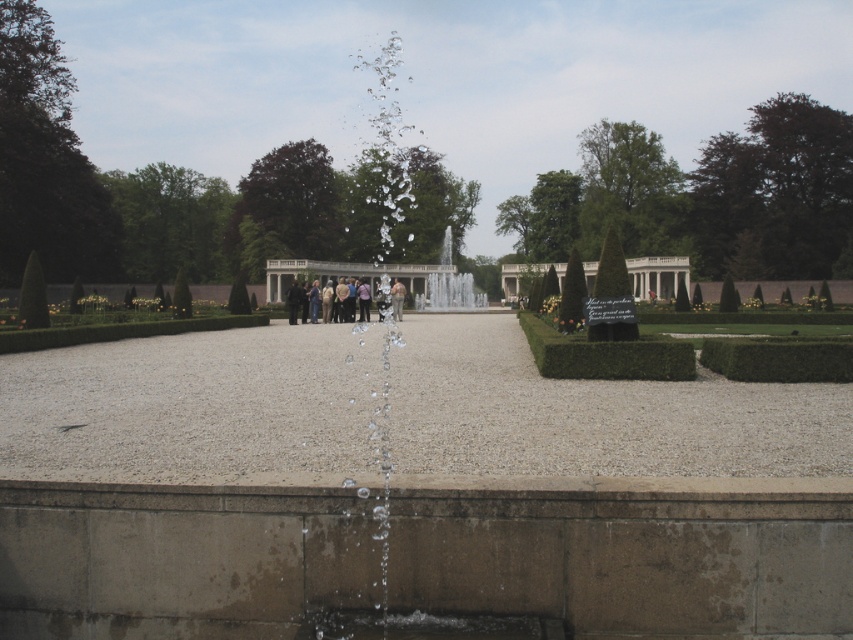
Describe the element at coordinates (450, 285) in the screenshot. I see `clear glass water at center` at that location.

Does point (450, 228) come farther from viewer compared to point (311, 285)?

Yes, point (450, 228) is farther from viewer.

You are a GUI agent. You are given a task and a screenshot of the screen. Output one action in this format:
    pyautogui.click(x=<x>, y=<y>)
    Task: Click on the clear glass water at center
    Image resolution: width=853 pixels, height=640 pixels.
    Given the screenshot: What is the action you would take?
    pyautogui.click(x=450, y=285)

How much distance is there between white stone palace at center and matte black people at center?

They are 23.28 meters apart.

Between point (585, 285) and point (332, 292), which one is positioned behind?

Positioned behind is point (332, 292).

Does point (645, 257) come behind point (312, 298)?

That is True.

This screenshot has height=640, width=853. I want to click on white stone palace at center, so click(x=657, y=275).

Does gray gravel path at center appear under green hedge at lower right?

Indeed, gray gravel path at center is positioned under green hedge at lower right.

Which is more to the left, gray gravel path at center or green hedge at lower right?

gray gravel path at center

Describe the element at coordinates (595, 413) in the screenshot. I see `gray gravel path at center` at that location.

Where is `gray gravel path at center`? This screenshot has width=853, height=640. gray gravel path at center is located at coordinates (595, 413).